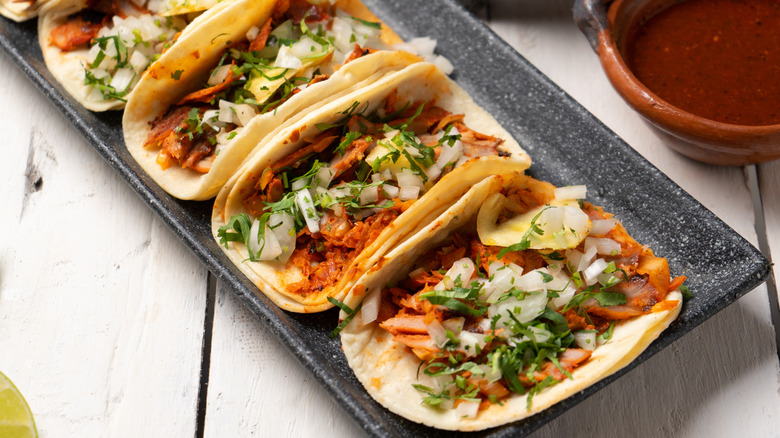
This screenshot has height=438, width=780. I want to click on white table planks, so click(225, 368), click(100, 281), click(708, 391).